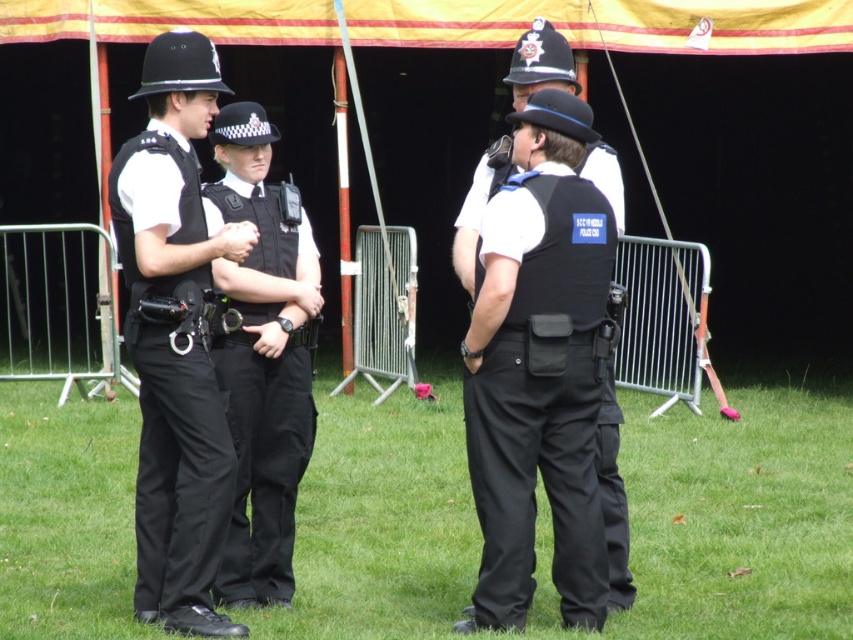
You are a photographer trying to capture a photo of the two officers in their uniforms. You want to ensure that the matte black uniform at left and the black uniform at center are both visible in the frame. Based on their positions, which officer should you position closer to the left side of the camera frame?

The matte black uniform at left is to the left of the black uniform at center, so positioning the matte black uniform at left closer to the left side of the camera frame will ensure both are visible.

You are a photographer positioned at the camera location. You want to capture a photo of the point at coordinates point (393, 22). Given that your camera has a maximum focus range of 40 feet, will you be able to focus on that point?

The point (393, 22) is 44.40 feet away from the camera. Since the camera can only focus up to 40 feet, it cannot focus on the point (393, 22) as it is beyond the maximum range.